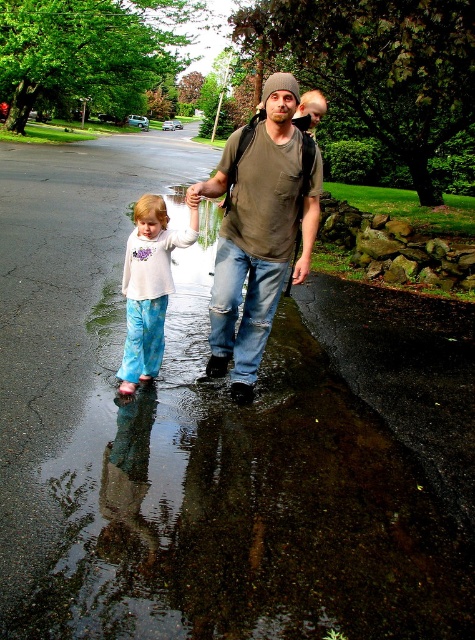
Question: Is matte green t-shirt at center to the right of white cotton shirt at center from the viewer's perspective?

Choices:
 (A) yes
 (B) no

Answer: (A)

Question: Which point appears farthest from the camera in this image?

Choices:
 (A) (161, 243)
 (B) (214, 284)

Answer: (B)

Question: Does matte green t-shirt at center have a lesser width compared to white cotton shirt at center?

Choices:
 (A) no
 (B) yes

Answer: (A)

Question: Does matte green t-shirt at center have a greater width compared to white cotton shirt at center?

Choices:
 (A) no
 (B) yes

Answer: (B)